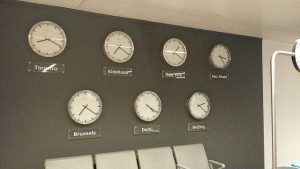
I want to click on gray wall, so click(x=254, y=48).